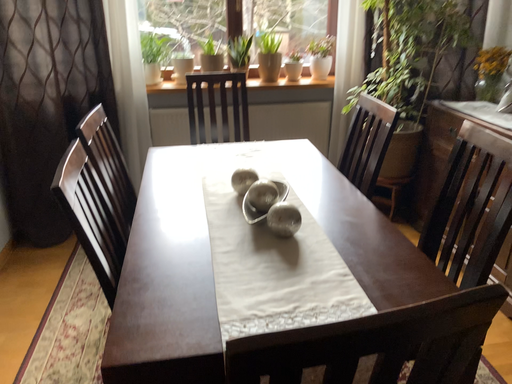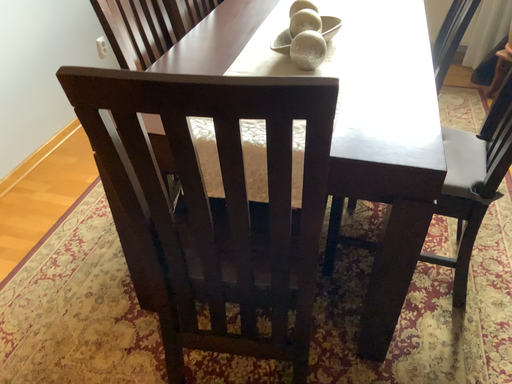
Question: Which way did the camera rotate in the video?

Choices:
 (A) rotated upward
 (B) rotated downward

Answer: (B)